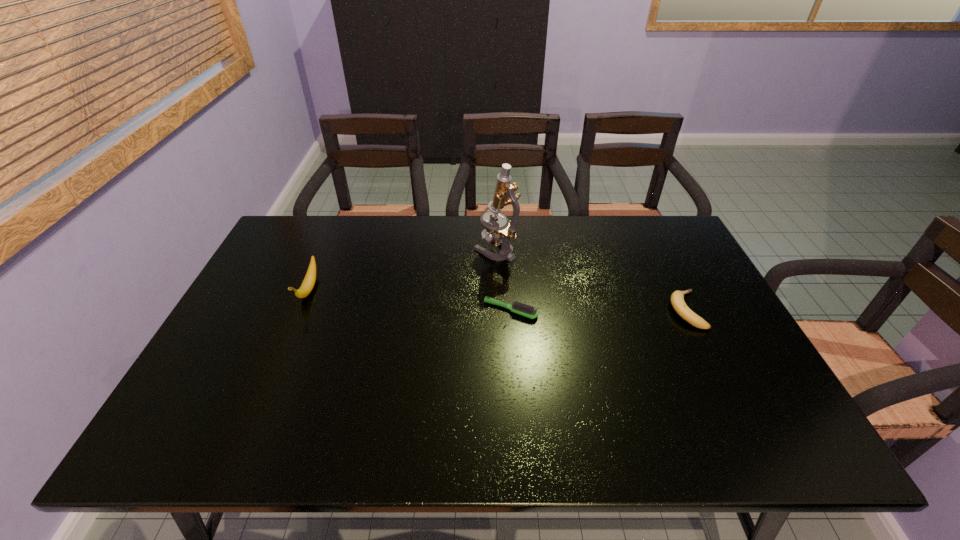
The image size is (960, 540). I want to click on free point located 0.140m on the back of the shortest object, so click(x=508, y=267).

Identify the location of object that is at the far edge. (504, 195).

This screenshot has height=540, width=960. In order to click on object at the left edge in this screenshot , I will do `click(308, 283)`.

Locate an element on the screen. This screenshot has width=960, height=540. object that is positioned at the right edge is located at coordinates (677, 298).

In the image, there is a desktop. At what (x,y) coordinates should I click in order to perform the action: click on free space at the far edge. Please return your answer as a coordinate pair (x, y). The width and height of the screenshot is (960, 540). Looking at the image, I should click on (434, 222).

Locate an element on the screen. This screenshot has height=540, width=960. vacant space at the near edge of the desktop is located at coordinates (677, 451).

Locate an element on the screen. free space at the left edge is located at coordinates (249, 302).

You are a GUI agent. You are given a task and a screenshot of the screen. Output one action in this format:
    pyautogui.click(x=<x>, y=<y>)
    Task: Click on the vacant position at the right edge of the desktop
    The image size is (960, 540).
    Given the screenshot: What is the action you would take?
    point(714,299)

Where is `vacant region at the far left corner`? The height and width of the screenshot is (540, 960). vacant region at the far left corner is located at coordinates (313, 218).

Identify the location of free space at the near left corner of the desktop. (227, 454).